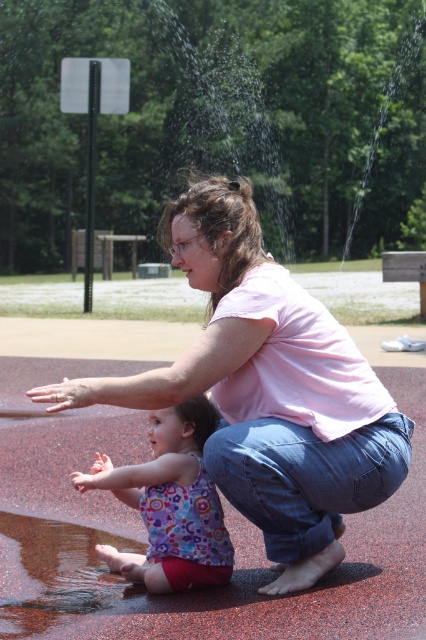
Question: Is pink cotton shirt at center to the left of floral tank top at center from the viewer's perspective?

Choices:
 (A) no
 (B) yes

Answer: (A)

Question: Among these objects, which one is farthest from the camera?

Choices:
 (A) pink cotton shirt at center
 (B) floral tank top at center

Answer: (B)

Question: Is pink cotton shirt at center bigger than floral tank top at center?

Choices:
 (A) no
 (B) yes

Answer: (B)

Question: Which of the following is the closest to the observer?

Choices:
 (A) floral tank top at center
 (B) pink cotton shirt at center

Answer: (B)

Question: Is pink cotton shirt at center thinner than floral tank top at center?

Choices:
 (A) yes
 (B) no

Answer: (B)